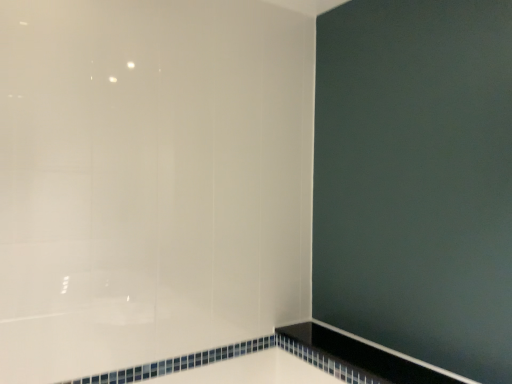
What do you see at coordinates (365, 355) in the screenshot? The height and width of the screenshot is (384, 512). I see `black glossy counter top at lower right` at bounding box center [365, 355].

What is the approximate height of black glossy counter top at lower right?

black glossy counter top at lower right is 4.00 centimeters tall.

Where is `black glossy counter top at lower right`? The height and width of the screenshot is (384, 512). black glossy counter top at lower right is located at coordinates (365, 355).

At what (x,y) coordinates should I click in order to perform the action: click on black glossy counter top at lower right. Please return your answer as a coordinate pair (x, y). The image size is (512, 384). Looking at the image, I should click on (365, 355).